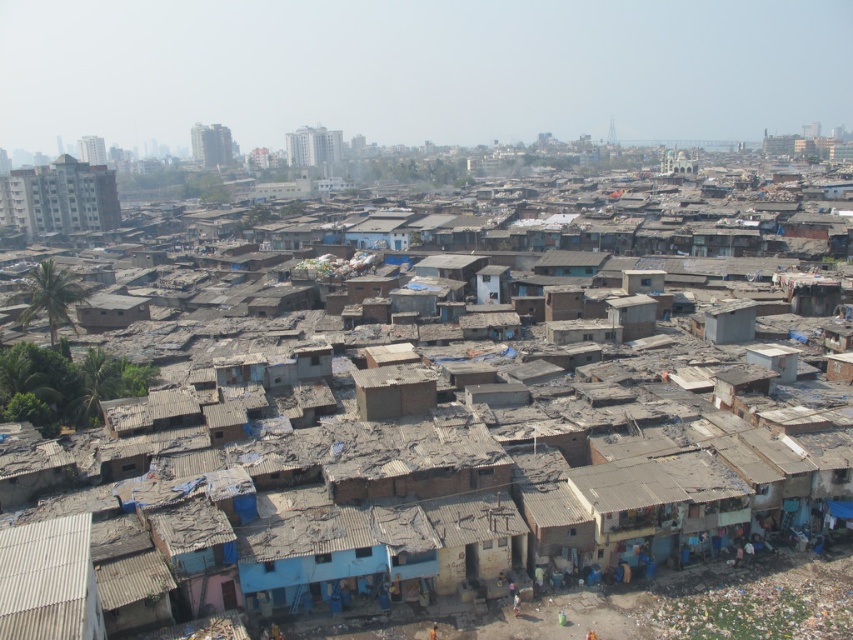
Question: Which object is positioned farthest from the matte concrete building at upper left?

Choices:
 (A) gray corrugated metal hut at lower left
 (B) brown mud brick hut at center

Answer: (A)

Question: Can you confirm if gray corrugated metal hut at lower left is wider than matte concrete building at upper left?

Choices:
 (A) no
 (B) yes

Answer: (A)

Question: Can you confirm if gray corrugated metal hut at lower left is wider than matte concrete building at upper left?

Choices:
 (A) yes
 (B) no

Answer: (B)

Question: Which of the following is the farthest from the observer?

Choices:
 (A) (62, 600)
 (B) (416, 392)
 (C) (65, 189)

Answer: (C)

Question: Which object appears farthest from the camera in this image?

Choices:
 (A) matte concrete building at upper left
 (B) gray corrugated metal hut at lower left

Answer: (A)

Question: Where is matte concrete building at upper left located in relation to brown mud brick hut at center in the image?

Choices:
 (A) above
 (B) below

Answer: (A)